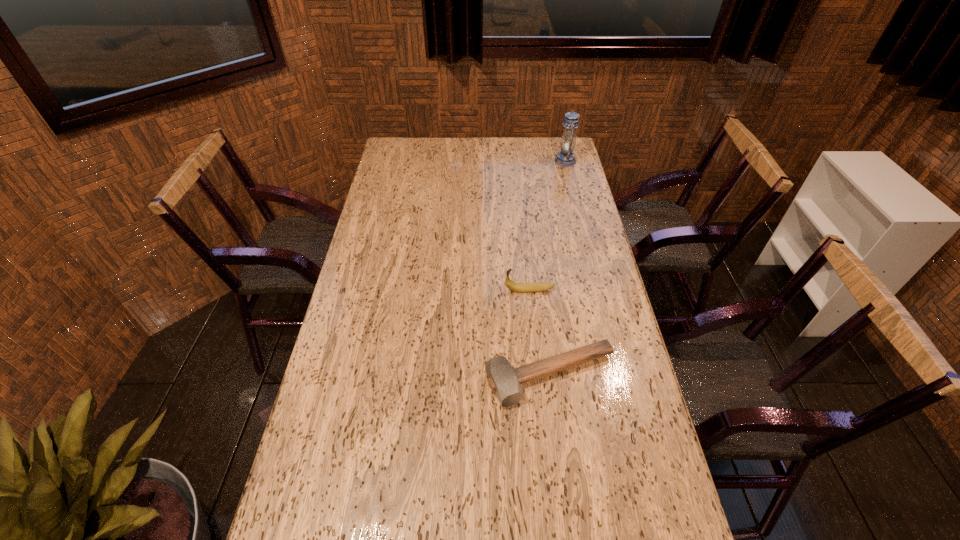
This screenshot has height=540, width=960. In order to click on vacant space located 0.240m at the stem of the banana in this screenshot , I will do [432, 290].

Where is `free spot located at the stem of the banana`? free spot located at the stem of the banana is located at coordinates coord(481,290).

This screenshot has width=960, height=540. What are the coordinates of `free region located on the front of the mallet` in the screenshot? It's located at (559, 447).

The image size is (960, 540). I want to click on object located at the far edge, so click(x=565, y=157).

At what (x,y) coordinates should I click in order to perform the action: click on lantern situated at the right edge. Please return your answer as a coordinate pair (x, y). Image resolution: width=960 pixels, height=540 pixels. Looking at the image, I should click on (565, 157).

The height and width of the screenshot is (540, 960). I want to click on mallet at the right edge, so click(x=504, y=381).

Find the location of a particular element. This screenshot has width=960, height=540. object that is at the far right corner is located at coordinates (565, 157).

Locate an element on the screen. free spot at the far edge of the desktop is located at coordinates 442,161.

Where is `free space at the left edge of the desktop`? The height and width of the screenshot is (540, 960). free space at the left edge of the desktop is located at coordinates (382, 175).

I want to click on free spot at the right edge of the desktop, so click(560, 179).